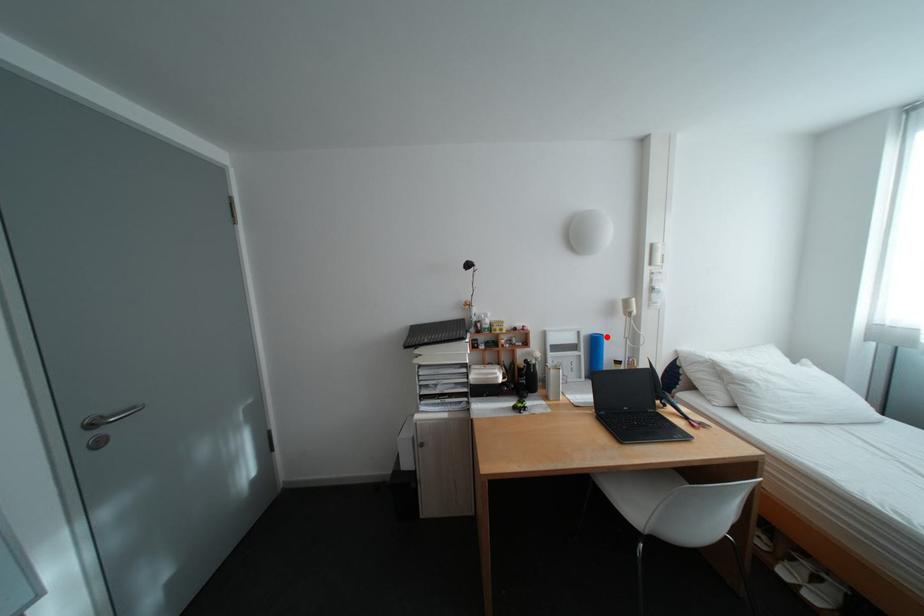
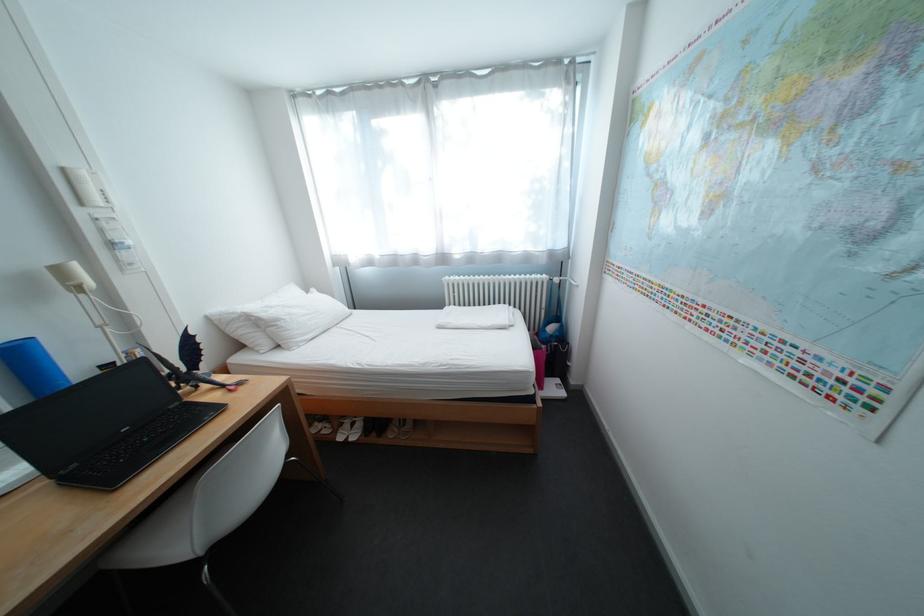
Locate, in the second image, the point that corresponds to the highlighted location in the first image.

(17, 347)